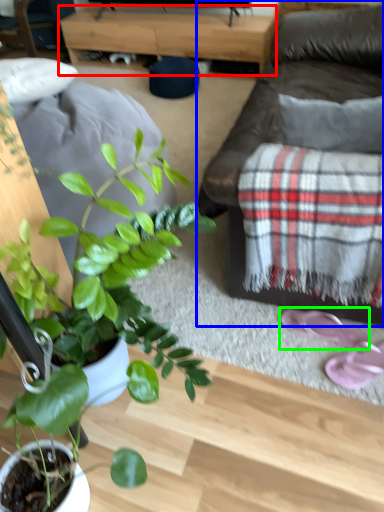
Question: Considering the real-world distances, which object is closest to table (highlighted by a red box)? studio couch (highlighted by a blue box) or footwear (highlighted by a green box).

Choices:
 (A) studio couch
 (B) footwear

Answer: (A)